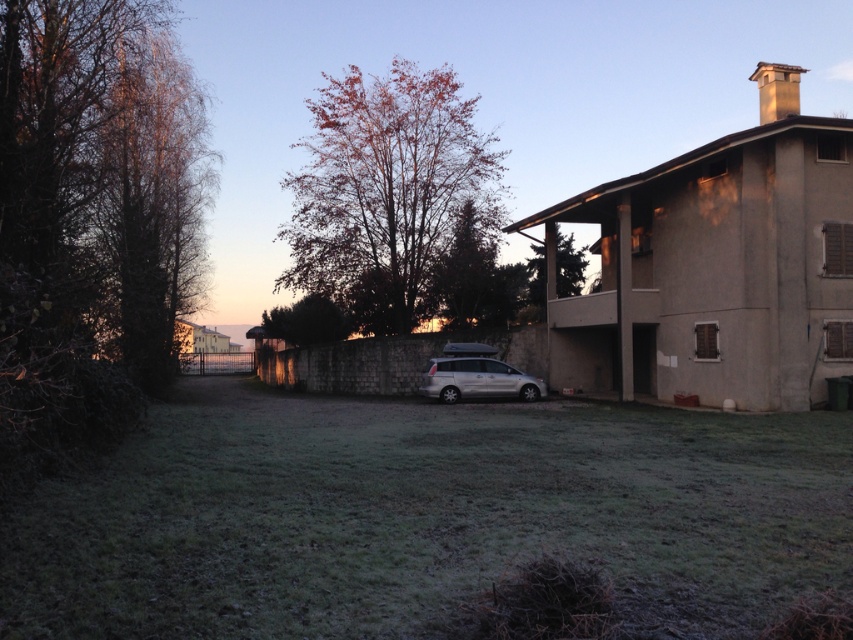
Which is below, reddish-brown bark tree at center or green leafy tree at upper center?

reddish-brown bark tree at center is lower down.

Who is higher up, reddish-brown bark tree at center or green leafy tree at upper center?

green leafy tree at upper center is above.

Which is behind, point (442, 252) or point (540, 292)?

The point (540, 292) is behind.

This screenshot has width=853, height=640. Identify the location of reddish-brown bark tree at center. (465, 273).

Does silver metallic van at center appear on the left side of green leafy tree at upper center?

Correct, you'll find silver metallic van at center to the left of green leafy tree at upper center.

Based on the photo, can you confirm if silver metallic van at center is shorter than green leafy tree at upper center?

Correct, silver metallic van at center is not as tall as green leafy tree at upper center.

Identify the location of silver metallic van at center. This screenshot has height=640, width=853. (477, 380).

Can you confirm if dark brown bark tree at left is bigger than silver metallic van at center?

Correct, dark brown bark tree at left is larger in size than silver metallic van at center.

Is dark brown bark tree at left above silver metallic van at center?

Yes.

Which is in front, point (71, 154) or point (442, 394)?

Point (71, 154) is more forward.

Locate an element on the screen. The height and width of the screenshot is (640, 853). dark brown bark tree at left is located at coordinates (94, 198).